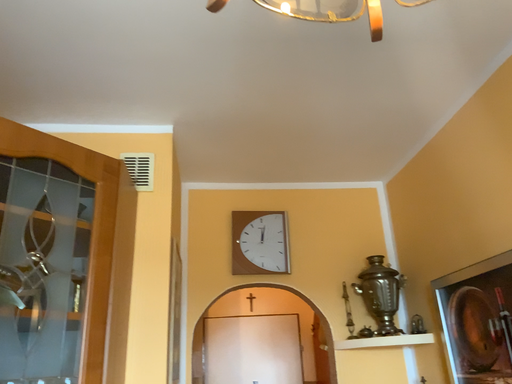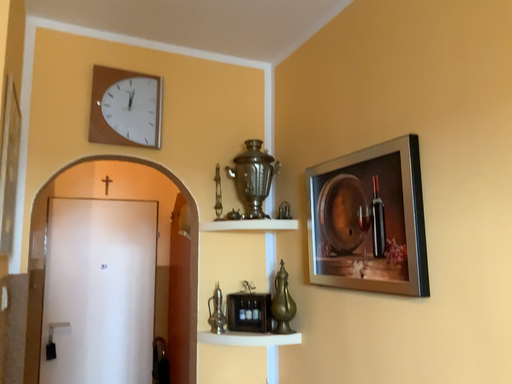
Question: How did the camera likely rotate when shooting the video?

Choices:
 (A) rotated left
 (B) rotated right

Answer: (B)